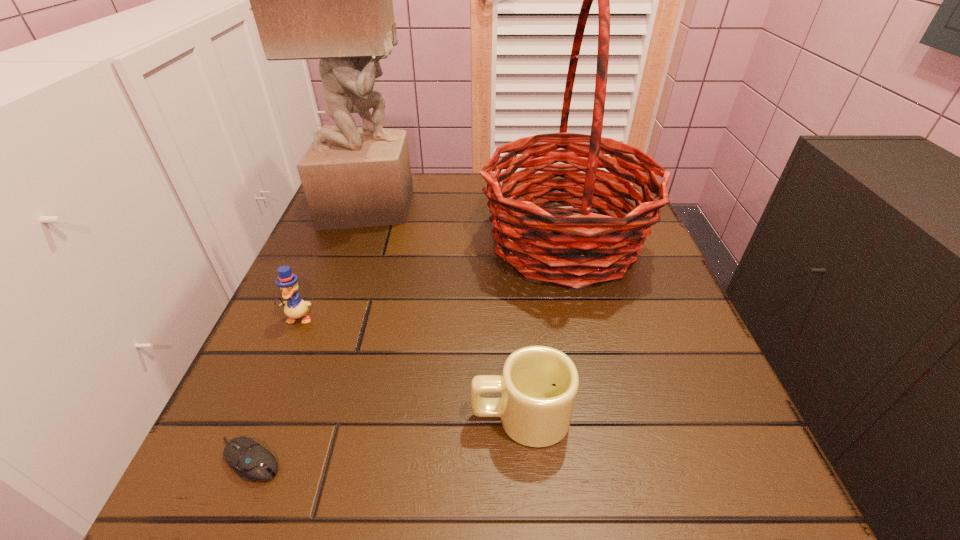
What are the coordinates of `unoccupied position between the sculpture and the basket` in the screenshot? It's located at (468, 224).

Locate an element on the screen. Image resolution: width=960 pixels, height=540 pixels. free area in between the mug and the sculpture is located at coordinates (445, 312).

I want to click on free space between the sculpture and the mug, so point(445,312).

Where is `vacant space in between the shortest object and the basket`? This screenshot has height=540, width=960. vacant space in between the shortest object and the basket is located at coordinates (407, 351).

Find the location of `free space between the third farthest object and the sculpture`. free space between the third farthest object and the sculpture is located at coordinates (334, 262).

This screenshot has width=960, height=540. I want to click on object that stands as the fourth closest to the third farthest object, so click(539, 384).

Locate an element on the screen. Image resolution: width=960 pixels, height=540 pixels. object that ranks as the second closest to the basket is located at coordinates (539, 384).

Where is `vacant space that satisfies the following two spatial constraints: 1. on the back side of the basket; 2. on the front-facing side of the sculpture`? This screenshot has width=960, height=540. vacant space that satisfies the following two spatial constraints: 1. on the back side of the basket; 2. on the front-facing side of the sculpture is located at coordinates (556, 206).

Where is `free location that satisfies the following two spatial constraints: 1. on the front-facing side of the sculpture; 2. on the face of the third nearest object, where the monocle is placed`? This screenshot has height=540, width=960. free location that satisfies the following two spatial constraints: 1. on the front-facing side of the sculpture; 2. on the face of the third nearest object, where the monocle is placed is located at coordinates (331, 318).

Where is `free space in the image that satisfies the following two spatial constraints: 1. on the front side of the basket; 2. with the handle on the side of the mug`? This screenshot has width=960, height=540. free space in the image that satisfies the following two spatial constraints: 1. on the front side of the basket; 2. with the handle on the side of the mug is located at coordinates (606, 416).